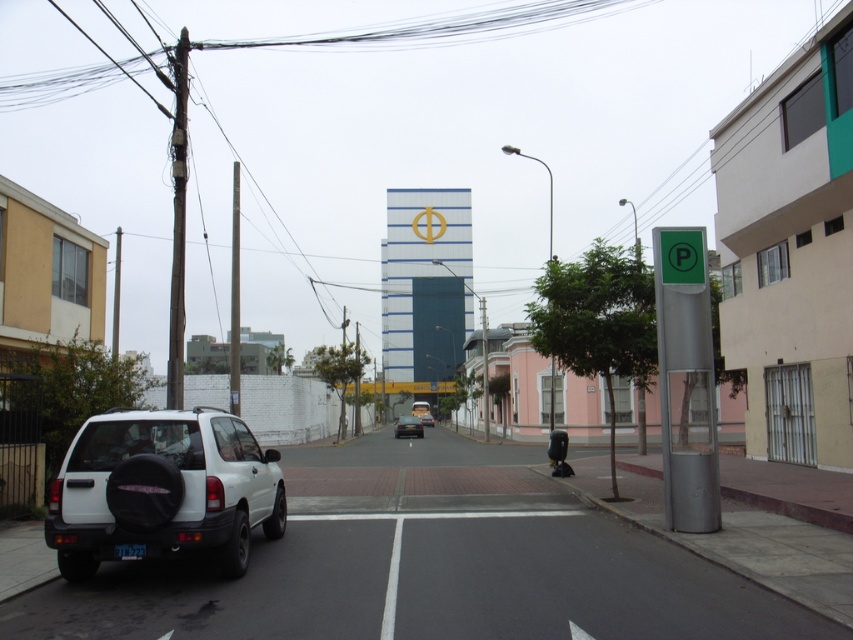
Question: Does green metallic parking sign at right have a smaller size compared to shiny black sedan at center?

Choices:
 (A) yes
 (B) no

Answer: (A)

Question: Is white matte suv at lower left positioned in front of white matte car at center?

Choices:
 (A) yes
 (B) no

Answer: (A)

Question: Is green plastic parking sign at right thinner than white matte car at center?

Choices:
 (A) yes
 (B) no

Answer: (A)

Question: Among these objects, which one is farthest from the camera?

Choices:
 (A) black plastic license plate at lower left
 (B) white matte suv at lower left
 (C) shiny black sedan at center
 (D) white matte car at center

Answer: (D)

Question: Among these objects, which one is farthest from the camera?

Choices:
 (A) green metallic parking sign at right
 (B) shiny black sedan at center
 (C) black plastic license plate at lower left

Answer: (B)

Question: Which object is farther from the camera taking this photo?

Choices:
 (A) shiny black sedan at center
 (B) black plastic license plate at lower left
 (C) white matte suv at lower left

Answer: (A)